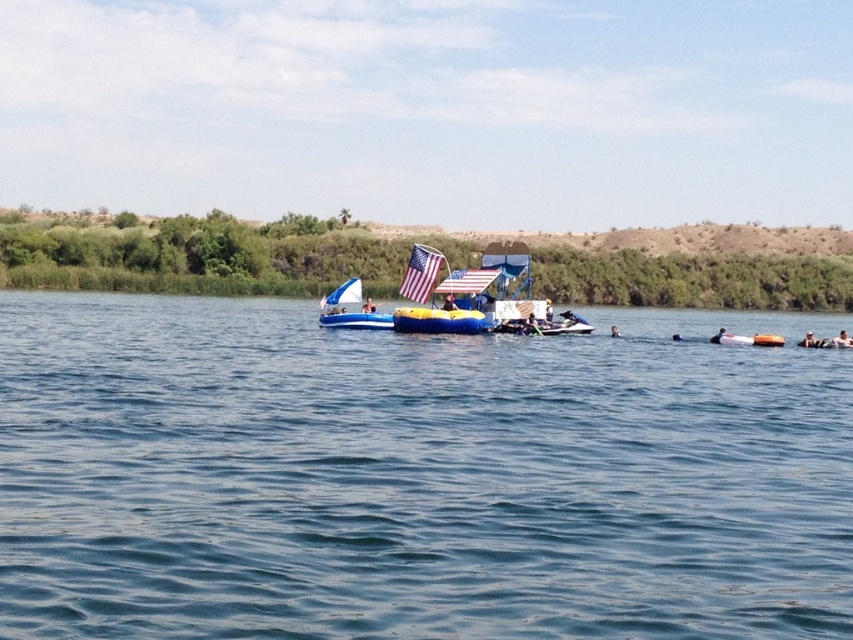
Question: Can you confirm if blue rubber boat at center is positioned below american flag at center?

Choices:
 (A) yes
 (B) no

Answer: (A)

Question: Which point appears farthest from the camera in this image?

Choices:
 (A) (779, 339)
 (B) (555, 544)

Answer: (A)

Question: Estimate the real-world distances between objects in this image. Which object is farther from the blue rubber boat at center?

Choices:
 (A) smooth orange buoy at center
 (B) american flag at center

Answer: (A)

Question: Among these objects, which one is nearest to the camera?

Choices:
 (A) brown foam at center
 (B) blue rubber boat at center

Answer: (B)

Question: Is matte blue inflatable boat at center further to the viewer compared to smooth orange buoy at center?

Choices:
 (A) yes
 (B) no

Answer: (B)

Question: Does smooth orange surfboard at lower right have a lesser width compared to smooth skin person at center?

Choices:
 (A) yes
 (B) no

Answer: (B)